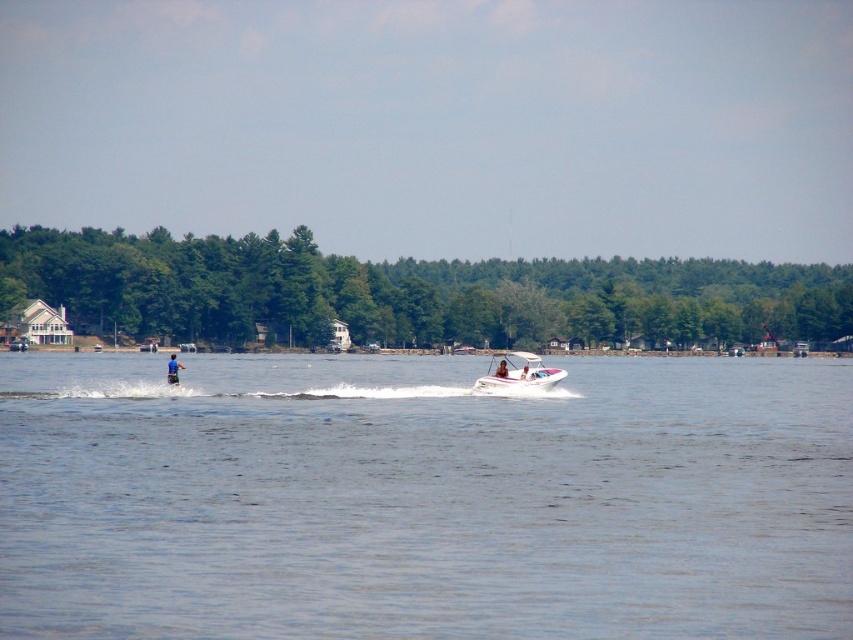
Question: Which point is closer to the camera taking this photo?

Choices:
 (A) (175, 385)
 (B) (489, 372)
 (C) (496, 369)
 (D) (820, 588)

Answer: (D)

Question: Does clear blue water at center have a larger size compared to white plastic boat at center?

Choices:
 (A) yes
 (B) no

Answer: (A)

Question: Which object is positioned farthest from the blue fabric person at center?

Choices:
 (A) white plastic boat at center
 (B) blue fabric at center

Answer: (B)

Question: Does clear blue water at center appear on the right side of blue fabric person at center?

Choices:
 (A) no
 (B) yes

Answer: (A)

Question: Which point appears closest to the camera in this image?

Choices:
 (A) [171, 384]
 (B) [498, 364]
 (C) [572, 419]

Answer: (C)

Question: Is blue fabric at center smaller than blue fabric person at center?

Choices:
 (A) yes
 (B) no

Answer: (B)